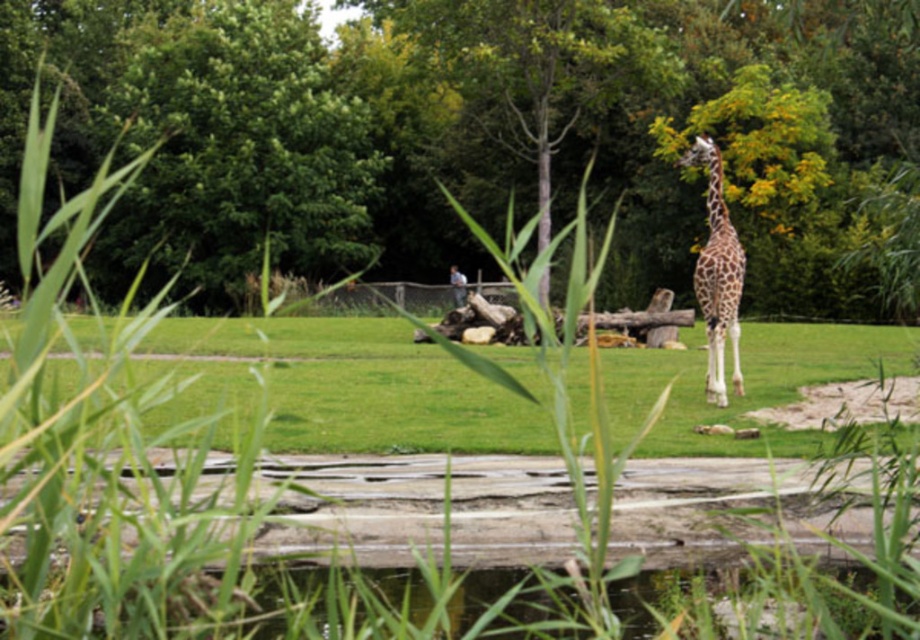
Identify the location of green leafy tree at upper center. This screenshot has width=920, height=640. (481, 134).

Who is shorter, green leafy tree at upper center or spotted fur giraffe at right?

spotted fur giraffe at right is shorter.

Locate an element on the screen. This screenshot has width=920, height=640. green leafy tree at upper center is located at coordinates (481, 134).

Does point (547, 168) lie behind point (426, 406)?

Yes, it is.

Is green leafy tree at upper center positioned at the back of green grassy at center?

No, green leafy tree at upper center is closer to the viewer.

You are a GUI agent. You are given a task and a screenshot of the screen. Output one action in this format:
    pyautogui.click(x=<x>, y=<y>)
    Task: Click on the green leafy tree at upper center
    
    Given the screenshot: What is the action you would take?
    pyautogui.click(x=481, y=134)

Does green grassy at center lie in front of spotted fur giraffe at right?

Yes, it is.

Measure the distance from green grassy at center to spotted fur giraffe at right.

green grassy at center is 6.70 meters from spotted fur giraffe at right.

Measure the distance between green grassy at center and camera.

green grassy at center is 12.27 meters from camera.

Locate an element on the screen. green grassy at center is located at coordinates (387, 394).